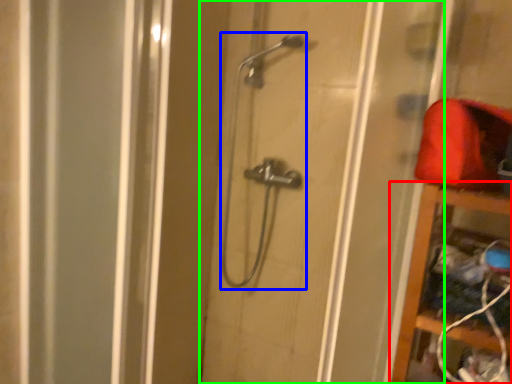
Question: Estimate the real-world distances between objects in this image. Which object is farther from cabinet (highlighted by a red box), shower (highlighted by a blue box) or door (highlighted by a green box)?

Choices:
 (A) shower
 (B) door

Answer: (A)